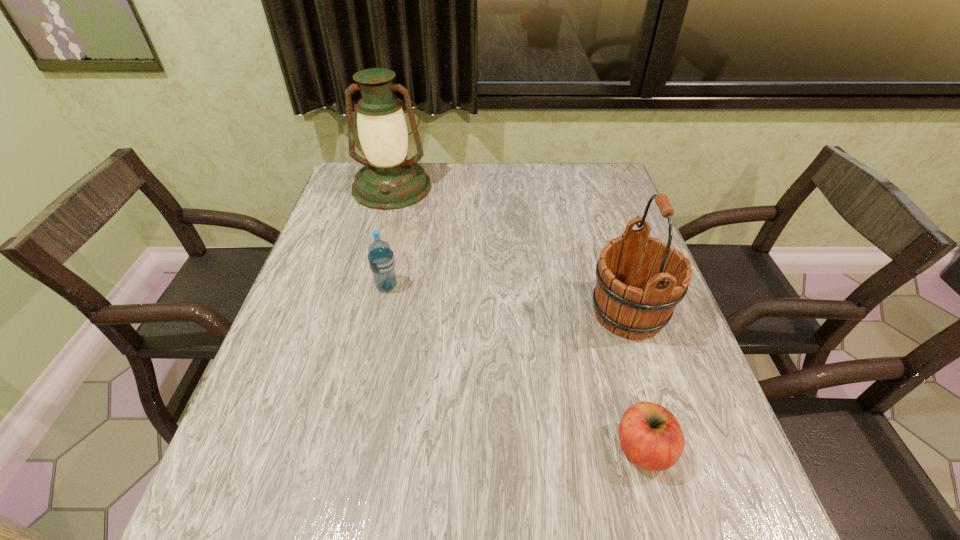
At what (x,y) coordinates should I click in order to perform the action: click on the farthest object. Please return your answer as a coordinate pair (x, y). The image size is (960, 540). Looking at the image, I should click on (388, 181).

This screenshot has width=960, height=540. I want to click on wine bucket, so click(x=638, y=299).

Find the location of `water bottle`. water bottle is located at coordinates (380, 256).

In order to click on the nearest object in this screenshot , I will do `click(650, 436)`.

Where is `the shortest object`? The height and width of the screenshot is (540, 960). the shortest object is located at coordinates (650, 436).

Identify the location of free point located with the light compartment facing forward on the farthest object. (361, 304).

Where is `vacant space located 0.080m on the front of the wine bucket`? vacant space located 0.080m on the front of the wine bucket is located at coordinates pyautogui.click(x=650, y=381).

Where is `free point located on the left of the water bottle`? The width and height of the screenshot is (960, 540). free point located on the left of the water bottle is located at coordinates (299, 286).

Where is `vacant point located on the back of the apple`? The height and width of the screenshot is (540, 960). vacant point located on the back of the apple is located at coordinates (626, 388).

This screenshot has height=540, width=960. Find the location of `object situated at the far edge`. object situated at the far edge is located at coordinates (388, 181).